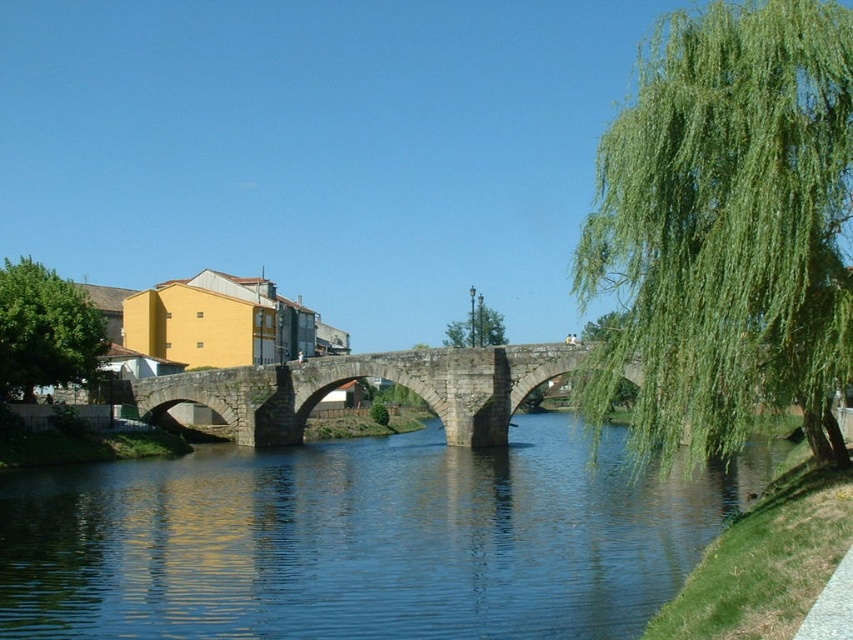
Question: Which of these objects is positioned closest to the blue stone bridge at center?

Choices:
 (A) green leafy willow at right
 (B) green leafy tree at center
 (C) stone bridge at center
 (D) green leafy tree at upper right

Answer: (C)

Question: Which point is farther from the camera taking this photo?

Choices:
 (A) (663, 438)
 (B) (461, 324)
 (C) (51, 563)
 (D) (228, 378)

Answer: (B)

Question: Can you confirm if stone bridge at center is positioned above green leafy tree at left?

Choices:
 (A) no
 (B) yes

Answer: (A)

Question: Which of the following is the closest to the observer?

Choices:
 (A) (456, 324)
 (B) (55, 273)
 (C) (677, 77)
 (D) (585, 328)

Answer: (C)

Question: Can you confirm if green leafy tree at left is positioned to the right of green leafy tree at upper right?

Choices:
 (A) yes
 (B) no

Answer: (B)

Question: Does green leafy tree at left lie behind green leafy tree at center?

Choices:
 (A) yes
 (B) no

Answer: (B)